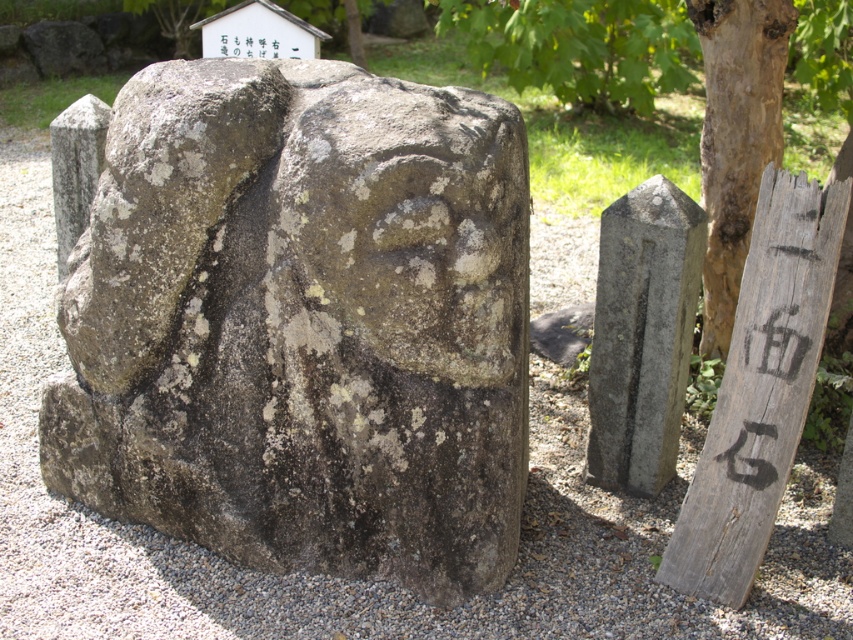
What is located at the coordinates point (x=413, y=225) in the image?

The rough stone face at center is located at point (x=413, y=225).

You are an art student analyzing the sculpture in the garden. You notice two parts of the sculpture labeled as the rusty stone statue at center and the rough stone face at center. Which part of the sculpture is bigger?

The rusty stone statue at center is larger in size compared to the rough stone face at center.

You are an art student analyzing the sculpture. You observe the rusty stone statue at center and the rough stone face at center. Which part of the sculpture is wider?

The rusty stone statue at center is wider than the rough stone face at center.